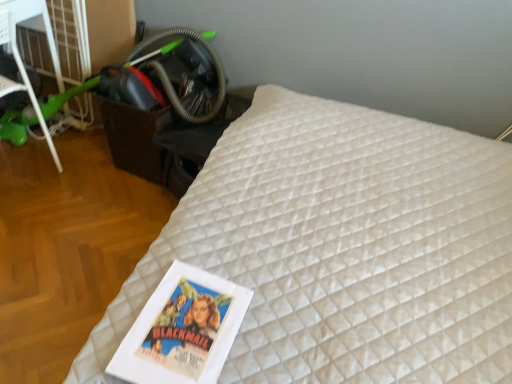
Question: From the image's perspective, is black plastic table at lower left under white quilted mattress at center?

Choices:
 (A) no
 (B) yes

Answer: (A)

Question: Can you confirm if black plastic table at lower left is shorter than white quilted mattress at center?

Choices:
 (A) no
 (B) yes

Answer: (B)

Question: Considering the relative sizes of black plastic table at lower left and white quilted mattress at center in the image provided, is black plastic table at lower left taller than white quilted mattress at center?

Choices:
 (A) yes
 (B) no

Answer: (B)

Question: Is black plastic table at lower left beside white quilted mattress at center?

Choices:
 (A) yes
 (B) no

Answer: (B)

Question: From the image's perspective, is black plastic table at lower left located above white quilted mattress at center?

Choices:
 (A) yes
 (B) no

Answer: (A)

Question: Is black plastic table at lower left spatially inside green plastic scooter at left, or outside of it?

Choices:
 (A) outside
 (B) inside

Answer: (A)

Question: Is black plastic table at lower left wider or thinner than green plastic scooter at left?

Choices:
 (A) thin
 (B) wide

Answer: (B)

Question: In the image, is black plastic table at lower left on the left side or the right side of green plastic scooter at left?

Choices:
 (A) left
 (B) right

Answer: (B)

Question: Is point pos(192,180) closer or farther from the camera than point pos(57,61)?

Choices:
 (A) closer
 (B) farther

Answer: (A)

Question: From the image's perspective, is white quilted mattress at center located above or below black plastic table at lower left?

Choices:
 (A) above
 (B) below

Answer: (B)

Question: Considering the positions of point (252, 137) and point (196, 157), is point (252, 137) closer or farther from the camera than point (196, 157)?

Choices:
 (A) closer
 (B) farther

Answer: (A)

Question: In the image, is white quilted mattress at center positioned in front of or behind black plastic table at lower left?

Choices:
 (A) behind
 (B) front

Answer: (B)

Question: From their relative heights in the image, would you say white quilted mattress at center is taller or shorter than black plastic table at lower left?

Choices:
 (A) short
 (B) tall

Answer: (B)

Question: From the image's perspective, relative to white quilted mattress at center, is black plastic table at lower left above or below?

Choices:
 (A) above
 (B) below

Answer: (A)

Question: Is black plastic table at lower left wider or thinner than white quilted mattress at center?

Choices:
 (A) thin
 (B) wide

Answer: (A)